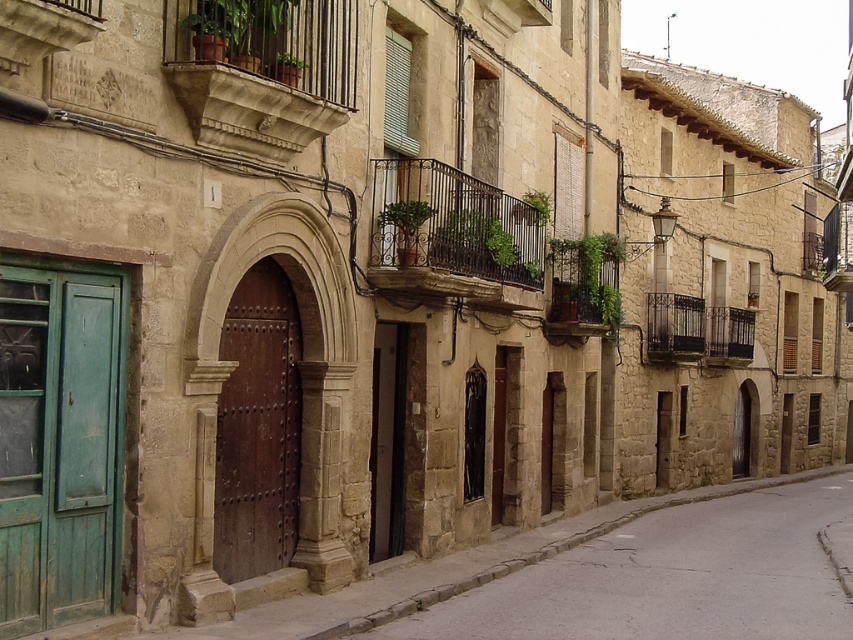
Can you confirm if smooth stone wall at center is wider than black wrought iron balcony at upper right?

Indeed, smooth stone wall at center has a greater width compared to black wrought iron balcony at upper right.

Between smooth stone wall at center and black wrought iron balcony at upper right, which one appears on the left side from the viewer's perspective?

smooth stone wall at center is more to the left.

Locate an element on the screen. The width and height of the screenshot is (853, 640). smooth stone wall at center is located at coordinates (668, 577).

Is point (287, 4) farther from viewer compared to point (241, 508)?

No, (287, 4) is closer to viewer.

The width and height of the screenshot is (853, 640). I want to click on stone textured balcony at upper left, so click(260, 70).

Is green matte door at left below stone textured balcony at upper left?

Yes, green matte door at left is below stone textured balcony at upper left.

Does green matte door at left have a lesser height compared to stone textured balcony at upper left?

No.

Which is behind, point (93, 376) or point (209, 84)?

Positioned behind is point (209, 84).

The height and width of the screenshot is (640, 853). In order to click on green matte door at left in this screenshot , I will do 59,444.